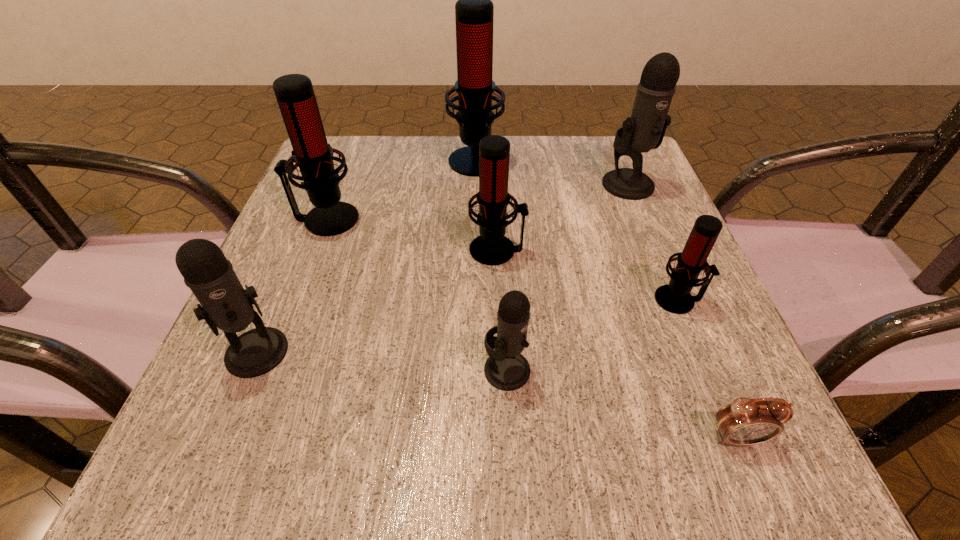
The image size is (960, 540). Find the location of `the shortest object`. the shortest object is located at coordinates (745, 421).

You are a GUI agent. You are given a task and a screenshot of the screen. Output one action in this format:
    pyautogui.click(x=<x>, y=<y>)
    Task: Click on the alarm clock
    This screenshot has height=540, width=960.
    Given the screenshot: What is the action you would take?
    pyautogui.click(x=745, y=421)

At what (x,y) coordinates should I click in order to perform the action: click on free space located on the front of the tallest object. Please return your answer as a coordinate pair (x, y). This screenshot has height=540, width=960. Looking at the image, I should click on (474, 240).

The height and width of the screenshot is (540, 960). I want to click on vacant space located on the front of the rightmost black microphone, so click(688, 334).

Where is `free space located on the front of the second biggest red microphone`? Image resolution: width=960 pixels, height=540 pixels. free space located on the front of the second biggest red microphone is located at coordinates (300, 287).

You are a GUI agent. You are given a task and a screenshot of the screen. Output one action in this format:
    pyautogui.click(x=<x>, y=<y>)
    Task: Click on the free space located on the back of the second smallest red microphone
    
    Given the screenshot: What is the action you would take?
    pyautogui.click(x=495, y=203)

This screenshot has width=960, height=540. Identify the location of vacant point located 0.230m on the right of the leftmost black microphone. (444, 352).

Find the location of a particular element. This screenshot has height=540, width=960. free space located on the left of the rightmost red microphone is located at coordinates (624, 300).

In order to click on free space located 0.100m on the left of the smallest black microphone in this screenshot , I will do `click(413, 370)`.

Locate an element on the screen. This screenshot has height=540, width=960. object positioned at the near edge is located at coordinates (745, 421).